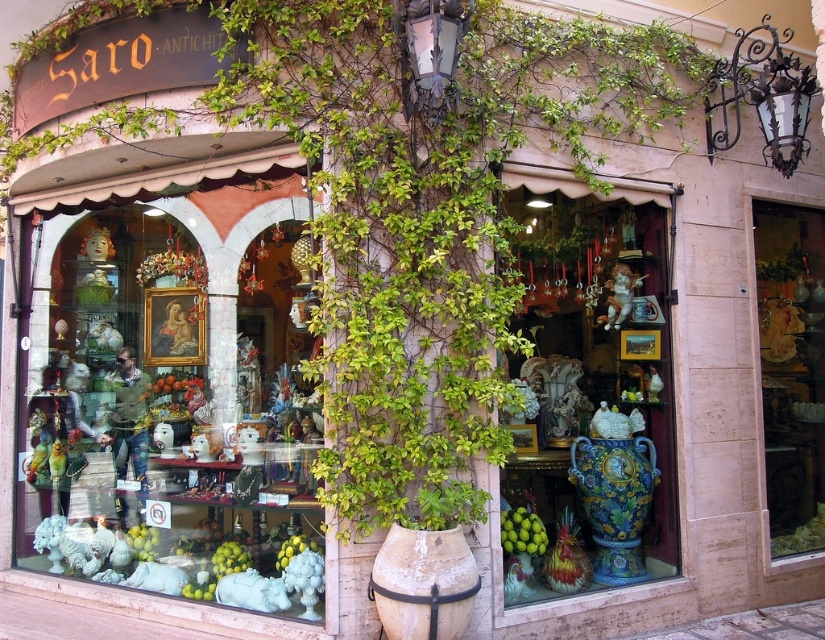
Is point (118, 220) positioned after point (409, 577)?

Yes, it is behind point (409, 577).

Is the position of matte white statue at center less distant than that of white earthenware vase at center?

No.

Does point (258, 536) come closer to viewer compared to point (399, 630)?

That is False.

Find the location of `matte white statue at center`. matte white statue at center is located at coordinates (167, 404).

The image size is (825, 640). Describe the element at coordinates (792, 371) in the screenshot. I see `matte ceramic vase at right` at that location.

Between matte ceramic vase at right and multicolored ceramic vase at center, which one appears on the left side from the viewer's perspective?

multicolored ceramic vase at center is more to the left.

Identify the location of matte ceramic vase at right. This screenshot has width=825, height=640. (792, 371).

The image size is (825, 640). Identify the location of matte ceramic vase at right. (792, 371).

Can you confirm if matte white statue at center is wider than matte ceramic vase at right?

Correct, the width of matte white statue at center exceeds that of matte ceramic vase at right.

Which is behind, point (222, 496) or point (783, 241)?

Positioned behind is point (783, 241).

Does point (277, 180) lie behind point (780, 470)?

No, it is not.

Locate an element on the screen. matte white statue at center is located at coordinates pos(167,404).